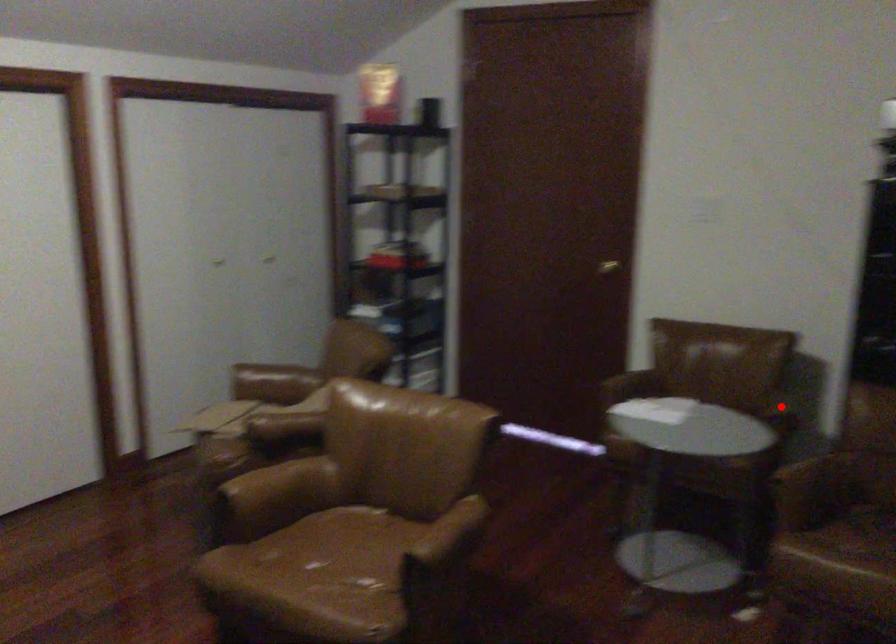
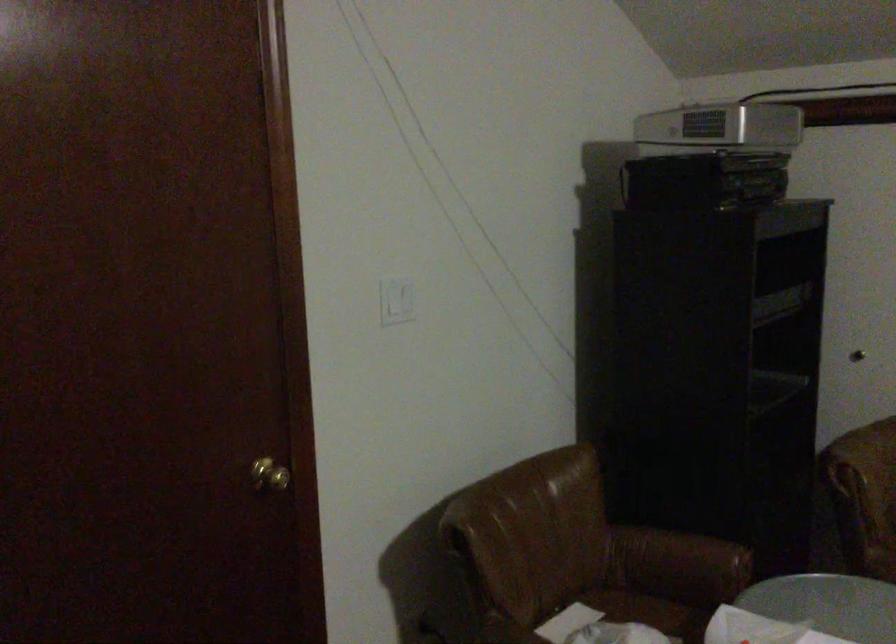
Question: I am providing you with two images of the same scene from different viewpoints. In image1, a red point is highlighted. Considering the same 3D point in image2, which of the following is correct?

Choices:
 (A) It is closer
 (B) It is farther

Answer: (A)